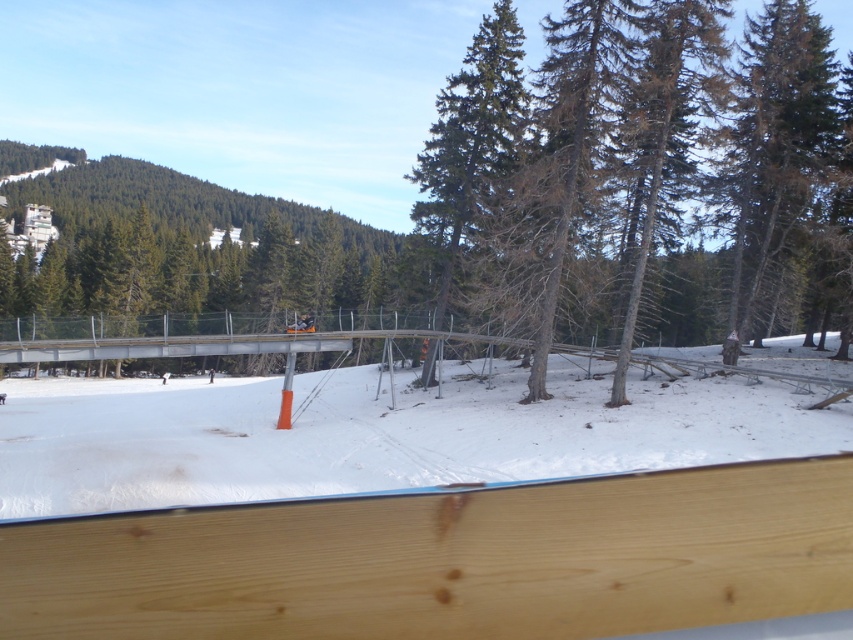
Is white snow at center positioned behind brown wood tree at right?

No, it is not.

Which is in front, point (438, 403) or point (782, 204)?

Positioned in front is point (782, 204).

Which is in front, point (811, 451) or point (810, 193)?

Positioned in front is point (811, 451).

You are a GUI agent. You are given a task and a screenshot of the screen. Output one action in this format:
    pyautogui.click(x=<x>, y=<y>)
    Task: Click on the white snow at center
    The height and width of the screenshot is (640, 853).
    Given the screenshot: What is the action you would take?
    pyautogui.click(x=376, y=433)

The image size is (853, 640). What do you see at coordinates (773, 144) in the screenshot?
I see `brown wood tree at right` at bounding box center [773, 144].

Is brown wood tree at right further to camera compared to green coniferous tree at center?

No, brown wood tree at right is in front of green coniferous tree at center.

Where is `brown wood tree at right`? This screenshot has width=853, height=640. brown wood tree at right is located at coordinates (773, 144).

How distant is brown/dried wood at center from white snow at center?

The distance of brown/dried wood at center from white snow at center is 11.64 meters.

Can you confirm if brown/dried wood at center is positioned to the left of white snow at center?

No, brown/dried wood at center is not to the left of white snow at center.

Who is more forward, [517,284] or [51,394]?

Point [517,284] is in front.

I want to click on brown/dried wood at center, so click(x=625, y=161).